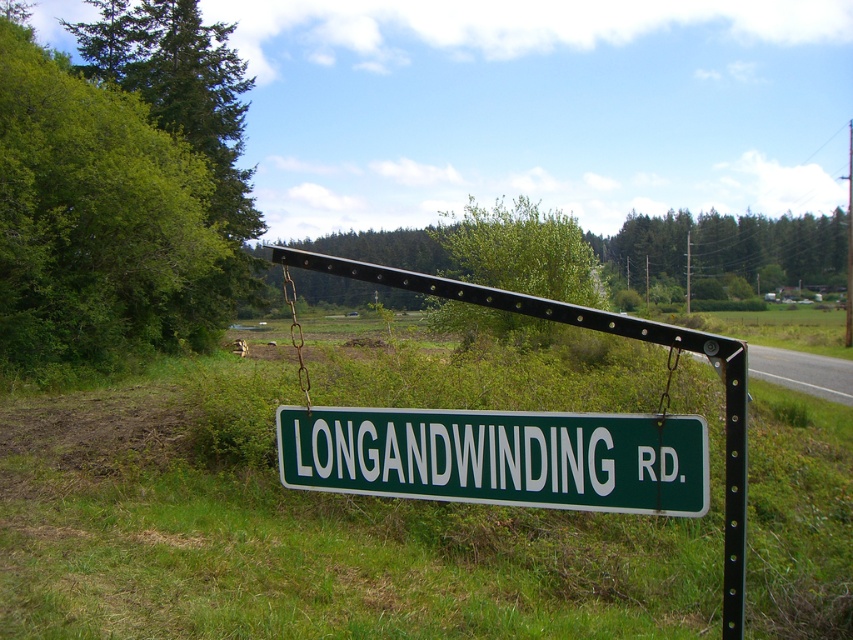
You are a gardener who needs to water the green grass at center and the green plastic sign at center. If your watering can has a range of 20 feet, can you water both without moving closer? Please explain your reasoning.

The green grass at center and the green plastic sign at center are 19.57 feet apart. Since the watering can has a range of 20 feet, which is greater than the distance between them, you can water both without moving closer.

You are a gardener who needs to mow the lawn. You see the green grass at center and the green plastic sign at center. Which object should you avoid cutting with the lawnmower?

You should avoid cutting the green plastic sign at center because it is shorter than the green grass at center and could be damaged by the lawnmower.